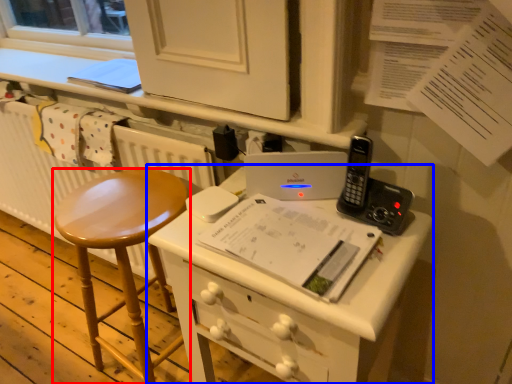
Question: Which object appears farthest to the camera in this image, stool (highlighted by a red box) or desk (highlighted by a blue box)?

Choices:
 (A) stool
 (B) desk

Answer: (A)